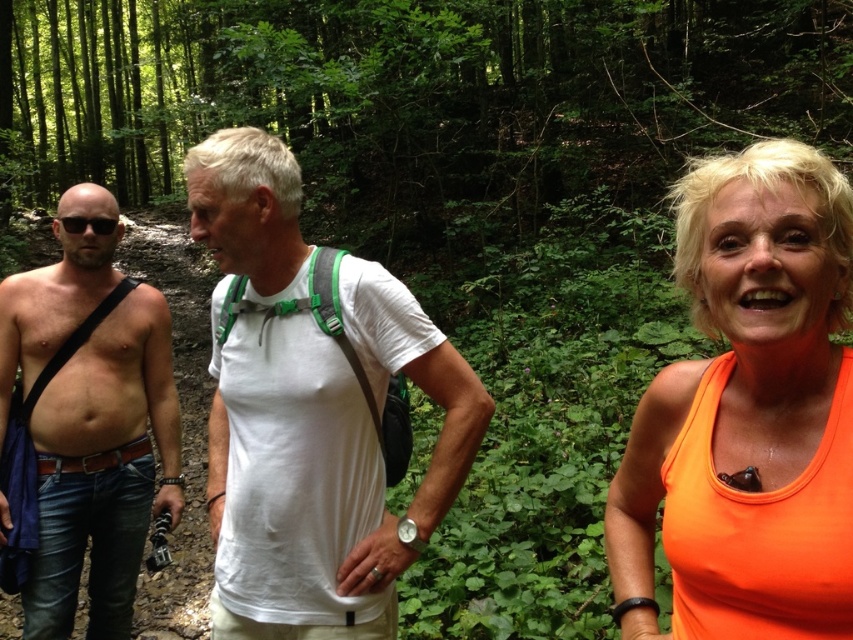
Question: Which object appears closest to the camera in this image?

Choices:
 (A) white matte t-shirt at center
 (B) bare skin at left

Answer: (A)

Question: Which object appears farthest from the camera in this image?

Choices:
 (A) white matte t-shirt at center
 (B) bare skin at left

Answer: (B)

Question: Does orange fabric tank top at center have a lesser width compared to bare skin at left?

Choices:
 (A) yes
 (B) no

Answer: (A)

Question: Is orange fabric tank top at center wider than white matte t-shirt at center?

Choices:
 (A) yes
 (B) no

Answer: (B)

Question: Which object is positioned farthest from the orange fabric tank top at center?

Choices:
 (A) bare skin at left
 (B) white matte t-shirt at center

Answer: (A)

Question: Is orange fabric tank top at center closer to camera compared to bare skin at left?

Choices:
 (A) yes
 (B) no

Answer: (A)